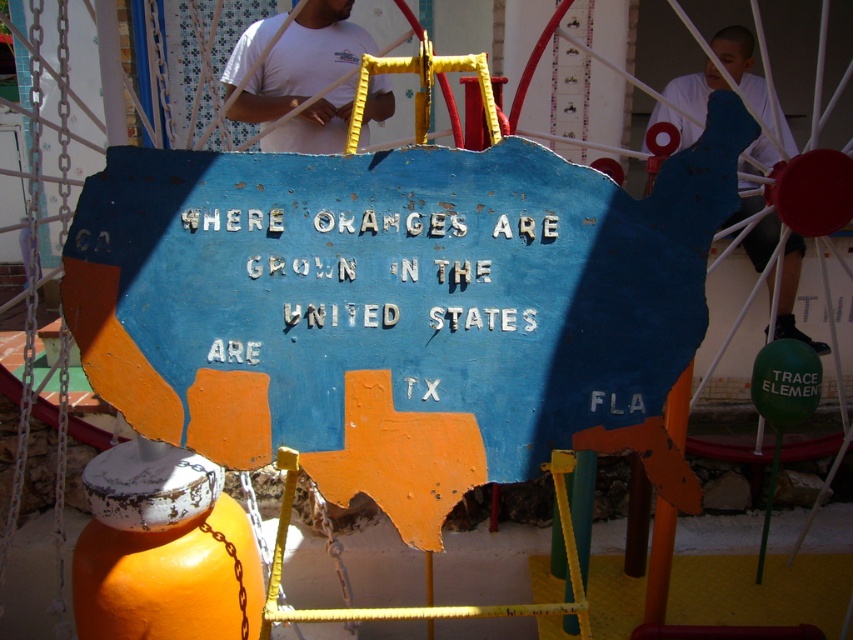
You are an artist standing in front of the map and want to place a small sticker on the object that is taller between the white painted letters at center and the white matte shirt at upper center. Which object should you choose?

The white matte shirt at upper center is taller than the white painted letters at center, so you should place the sticker on the white matte shirt at upper center.

You are a tailor standing 2 meters away from the map. You need to measure the distance between the white cotton shirt at upper center and the white matte shirt at upper center. Can you reach both shirts without moving closer than your current position?

The distance between the white cotton shirt at upper center and the white matte shirt at upper center is 1.70 meters. Since you are standing 2 meters away from the map, you can reach both shirts without needing to move closer as the distance between them is less than your current distance from the map.

You are standing in front of the map and see the point marked as point (x=303, y=60). What object or feature is located at this point?

The point (x=303, y=60) corresponds to the white cotton shirt at upper center.